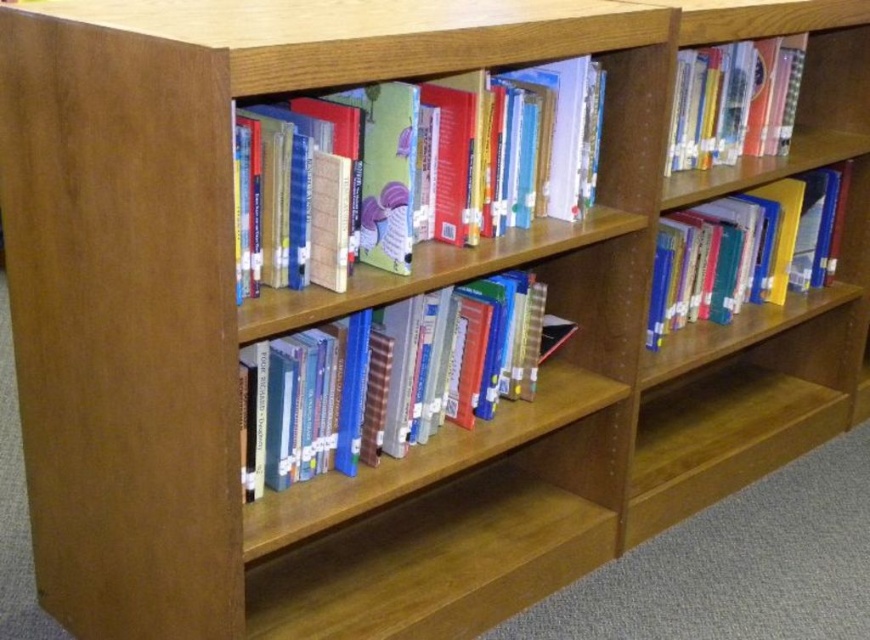
Can you confirm if yellow matte book at upper right is bigger than hardcover book at upper right?

Yes, yellow matte book at upper right is bigger than hardcover book at upper right.

Which is behind, point (808, 230) or point (773, 54)?

The point (808, 230) is more distant.

This screenshot has height=640, width=870. Find the location of `yellow matte book at upper right`. yellow matte book at upper right is located at coordinates (743, 252).

Is hardcover book at center shorter than yellow matte book at upper right?

Correct, hardcover book at center is not as tall as yellow matte book at upper right.

This screenshot has height=640, width=870. I want to click on hardcover book at center, so click(473, 156).

Locate an element on the screen. The height and width of the screenshot is (640, 870). hardcover book at center is located at coordinates (473, 156).

Is hardcover books at center positioned before yellow matte book at upper right?

Yes, it is.

Which of these two, hardcover books at center or yellow matte book at upper right, stands taller?

With more height is yellow matte book at upper right.

Who is more distant from viewer, (x=298, y=413) or (x=774, y=268)?

The point (x=774, y=268) is more distant.

I want to click on hardcover books at center, so click(x=392, y=378).